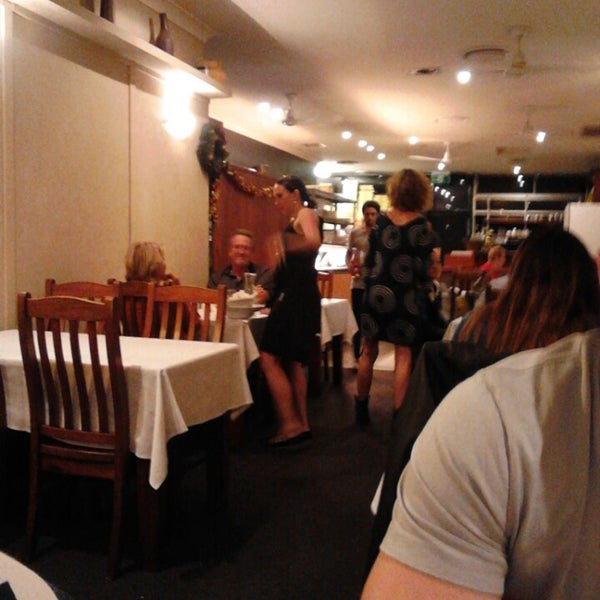
Image resolution: width=600 pixels, height=600 pixels. What are the coordinates of `chair` in the screenshot? It's located at (84, 313), (84, 293), (179, 296), (132, 291), (324, 279).